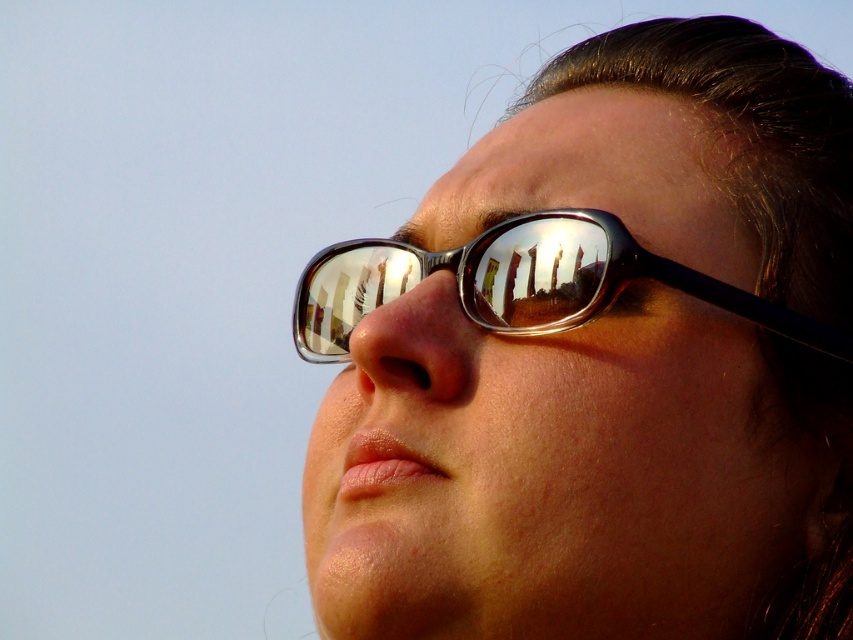
Is metallic reflective glasses at upper right behind metallic reflective glasses at center?

No, it is not.

Who is shorter, metallic reflective glasses at upper right or metallic reflective glasses at center?

metallic reflective glasses at center is shorter.

Describe the element at coordinates (601, 362) in the screenshot. I see `metallic reflective glasses at upper right` at that location.

This screenshot has height=640, width=853. I want to click on metallic reflective glasses at upper right, so click(x=601, y=362).